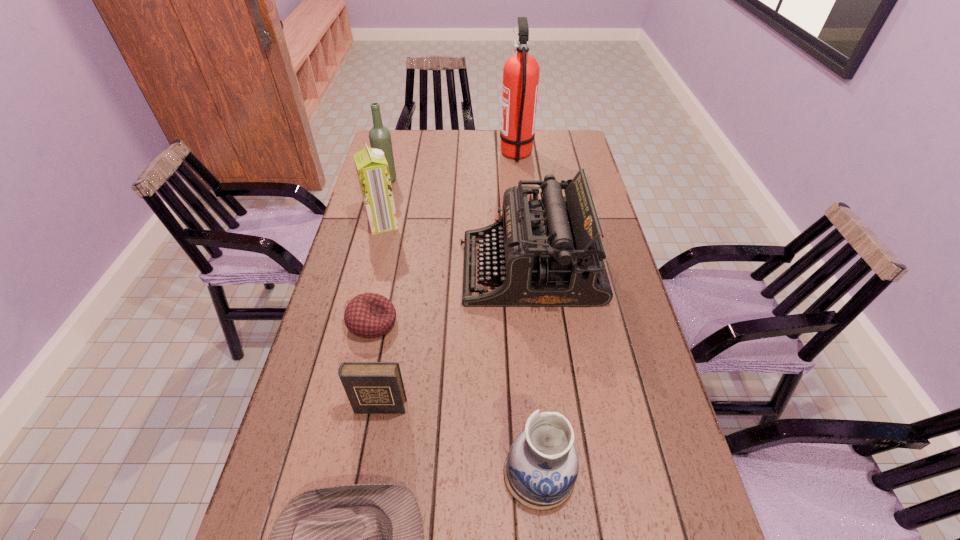
This screenshot has width=960, height=540. Find the location of `vacant space at the far right corner`. vacant space at the far right corner is located at coordinates (583, 144).

Image resolution: width=960 pixels, height=540 pixels. I want to click on free spot between the fourth shortest object and the seventh nearest object, so click(464, 326).

The width and height of the screenshot is (960, 540). What are the coordinates of `vacant area that lies between the soya milk and the typewriter` in the screenshot? It's located at (456, 246).

The image size is (960, 540). I want to click on free space between the diary and the pottery, so click(460, 440).

The height and width of the screenshot is (540, 960). I want to click on vacant point located between the typewriter and the shortest object, so click(451, 296).

This screenshot has width=960, height=540. I want to click on free spot between the beanbag and the second farthest object, so click(380, 252).

This screenshot has height=540, width=960. Find the location of `unoccupied position between the soya milk and the fire extinguisher`. unoccupied position between the soya milk and the fire extinguisher is located at coordinates (449, 189).

Identify which object is the fifth closest to the diary. Please provide its 2D coordinates. Your answer should be formatted as a tuple, i.e. [(x, y)], where the tuple contains the x and y coordinates of a point satisfying the conditions above.

[(372, 169)]

Select which object is the fourth closest to the farthest object. Please provide its 2D coordinates. Your answer should be formatted as a tuple, i.e. [(x, y)], where the tuple contains the x and y coordinates of a point satisfying the conditions above.

[(369, 315)]

This screenshot has width=960, height=540. I want to click on vacant space that satisfies the following two spatial constraints: 1. on the front cover of the fourth shortest object; 2. on the left side of the diary, so click(x=369, y=472).